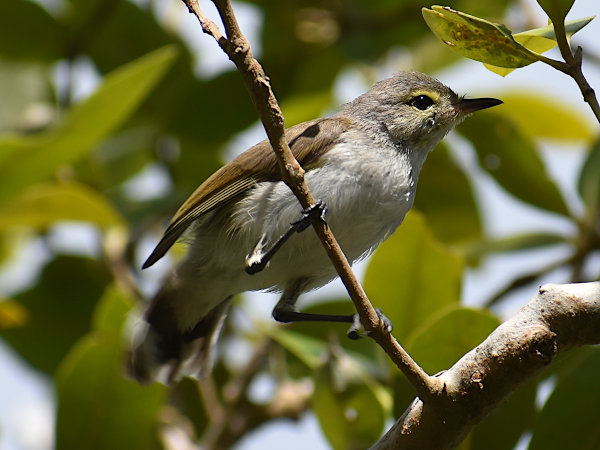
At what (x,y) coordinates should I click in order to perform the action: click on chest. Please return your answer as a coordinate pair (x, y). This screenshot has height=450, width=600. Looking at the image, I should click on (373, 200).